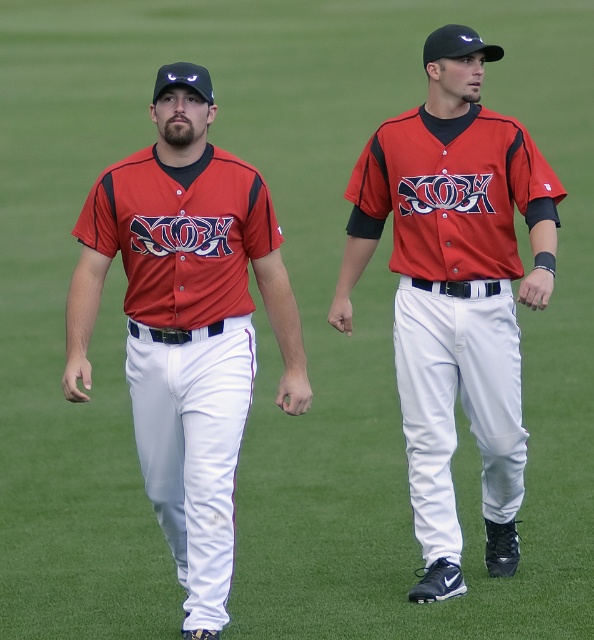
Who is positioned more to the left, matte red baseball uniform at center or matte jersey at center?

Positioned to the left is matte red baseball uniform at center.

Does matte red baseball uniform at center have a larger size compared to matte jersey at center?

No.

Where is `matte red baseball uniform at center`? This screenshot has height=640, width=594. matte red baseball uniform at center is located at coordinates (187, 323).